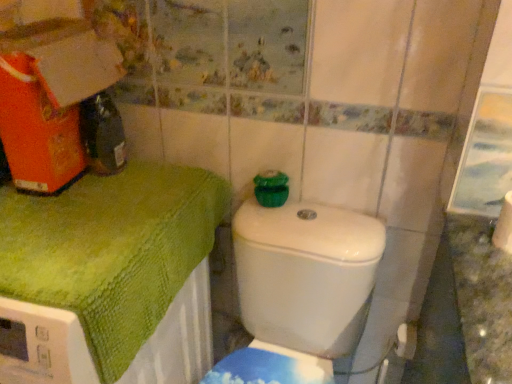
Question: Based on their sizes in the image, would you say white glossy toilet at center is bigger or smaller than green textured towel at upper left?

Choices:
 (A) big
 (B) small

Answer: (B)

Question: Is point (345, 327) closer or farther from the camera than point (59, 309)?

Choices:
 (A) closer
 (B) farther

Answer: (B)

Question: Which object is the farthest from the white matte toilet paper at lower right, marked as the second toilet paper in a bottom-to-top arrangement?

Choices:
 (A) green textured towel at upper left
 (B) white matte toilet paper at lower right, placed as the 1th toilet paper when sorted from bottom to top
 (C) white glossy toilet at center

Answer: (A)

Question: Which object is the closest to the green textured towel at upper left?

Choices:
 (A) white matte toilet paper at lower right, which is the 1th toilet paper in back-to-front order
 (B) white matte toilet paper at lower right, the 1th toilet paper from the top
 (C) white glossy toilet at center

Answer: (C)